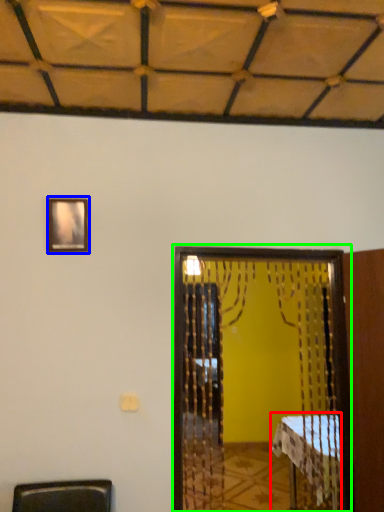
Question: Which object is positioned farthest from table (highlighted by a red box)? Select from picture frame (highlighted by a blue box) and screen door (highlighted by a green box).

Choices:
 (A) picture frame
 (B) screen door

Answer: (A)